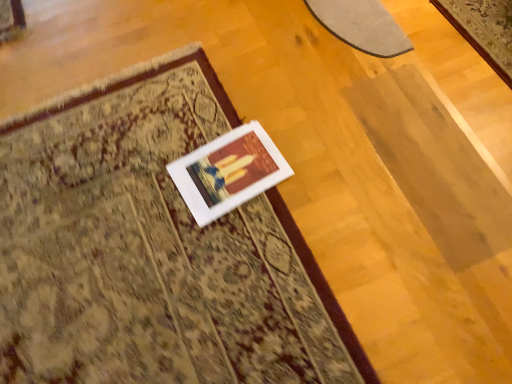
Question: Is matte gray rug at upper right, marked as the first mat in a right-to-left arrangement, taller or shorter than white matte picture frame at center?

Choices:
 (A) short
 (B) tall

Answer: (B)

Question: Is matte gray rug at upper right, marked as the first mat in a right-to-left arrangement, in front of or behind white matte picture frame at center in the image?

Choices:
 (A) behind
 (B) front

Answer: (A)

Question: Which is farther from the matte gray rug at upper right, marked as the first mat in a right-to-left arrangement?

Choices:
 (A) beige carpet at center, which is the 2th mat from right to left
 (B) white matte picture frame at center

Answer: (A)

Question: Which is nearer to the matte gray rug at upper right, which ranks as the first mat in top-to-bottom order?

Choices:
 (A) beige carpet at center, acting as the 2th mat starting from the back
 (B) white matte picture frame at center

Answer: (B)